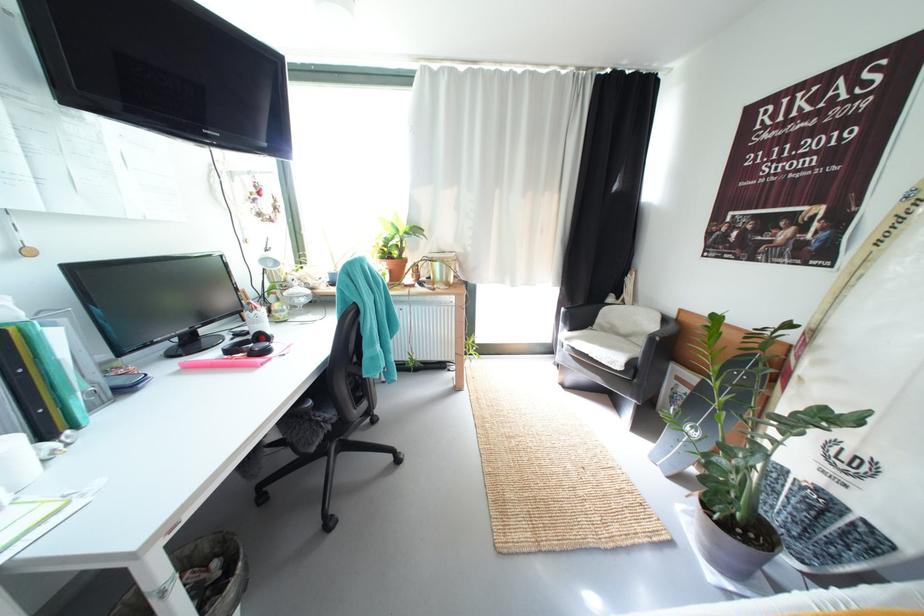
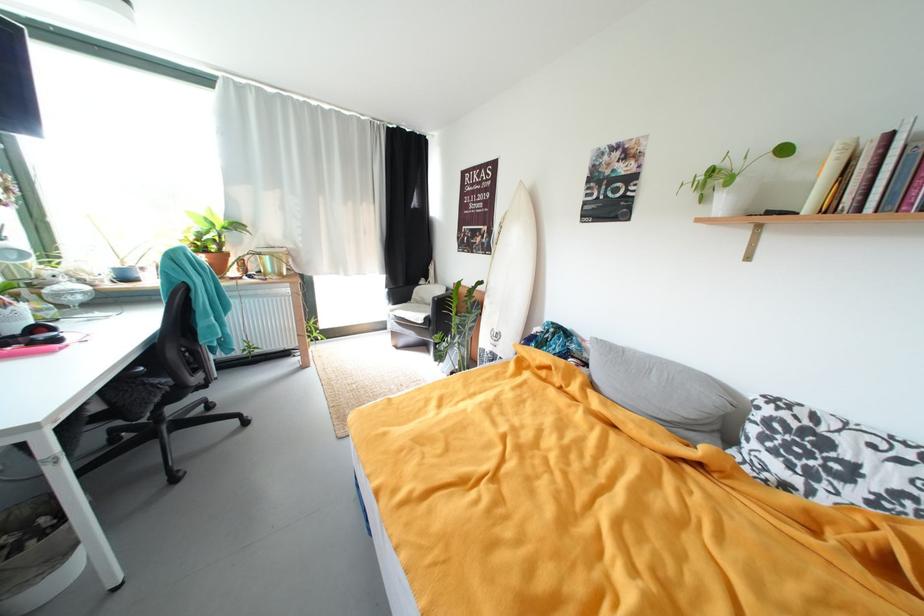
The point at (341, 273) is marked in the first image. Where is the corresponding point in the second image?

(127, 268)